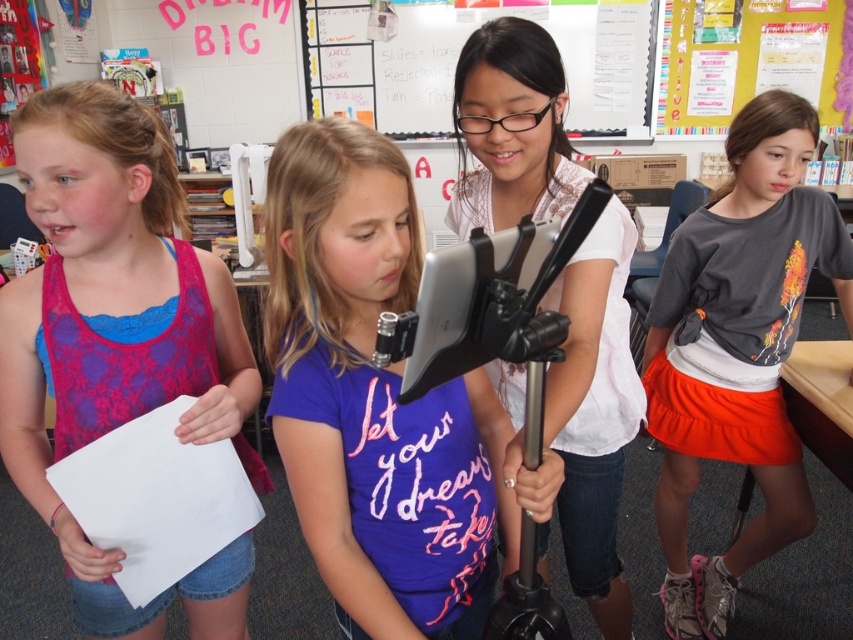
You are standing in the classroom and want to hand a note to the girl wearing the pink lace tank top at left. The note is 10 centimeters long. If you throw it directly towards her, will it reach her within 1 meter?

The distance between you and the pink lace tank top at left is 93.83 centimeters, which is less than 1 meter. Therefore, throwing the note directly should reach her within that distance.

You are standing at the origin point in the classroom. There is a purple matte shirt at center. Can you walk directly to the purple matte shirt at center without moving past the point at (x=374, y=401)?

The point at (x=374, y=401) corresponds to the purple matte shirt at center, so you are already at the location of the purple matte shirt at center. Therefore, you don